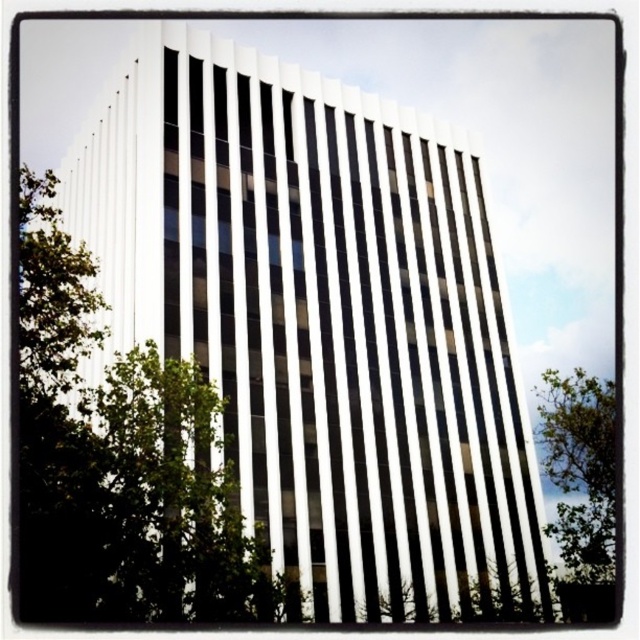
Does green leafy tree at center appear on the left side of green leafy tree at lower right?

Indeed, green leafy tree at center is positioned on the left side of green leafy tree at lower right.

Does green leafy tree at center have a lesser height compared to green leafy tree at lower right?

Incorrect, green leafy tree at center's height does not fall short of green leafy tree at lower right's.

Find the location of a particular element. green leafy tree at center is located at coordinates (122, 461).